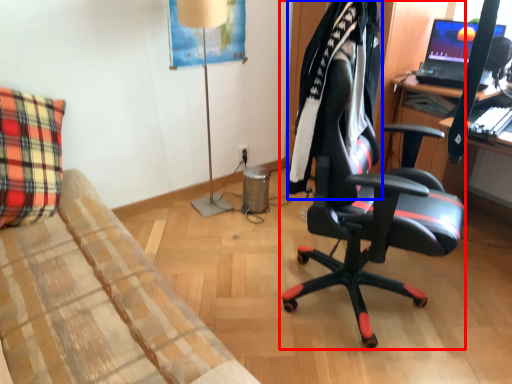
Question: Which object appears farthest to the camera in this image, chair (highlighted by a red box) or clothing (highlighted by a blue box)?

Choices:
 (A) chair
 (B) clothing

Answer: (B)